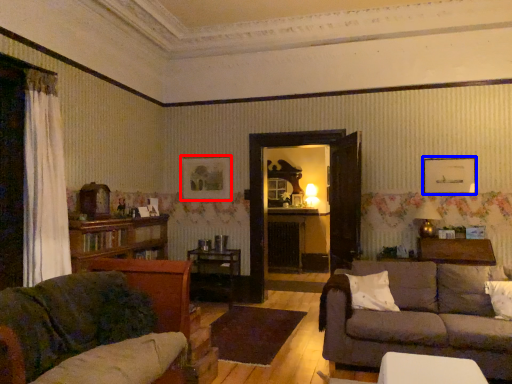
Question: Which object appears farthest to the camera in this image, picture frame (highlighted by a red box) or picture frame (highlighted by a blue box)?

Choices:
 (A) picture frame
 (B) picture frame

Answer: (A)